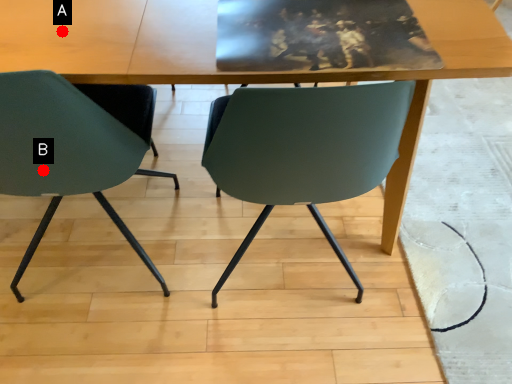
Question: Two points are circled on the image, labeled by A and B beside each circle. Which of the following is the closest to the observer?

Choices:
 (A) A is closer
 (B) B is closer

Answer: (A)